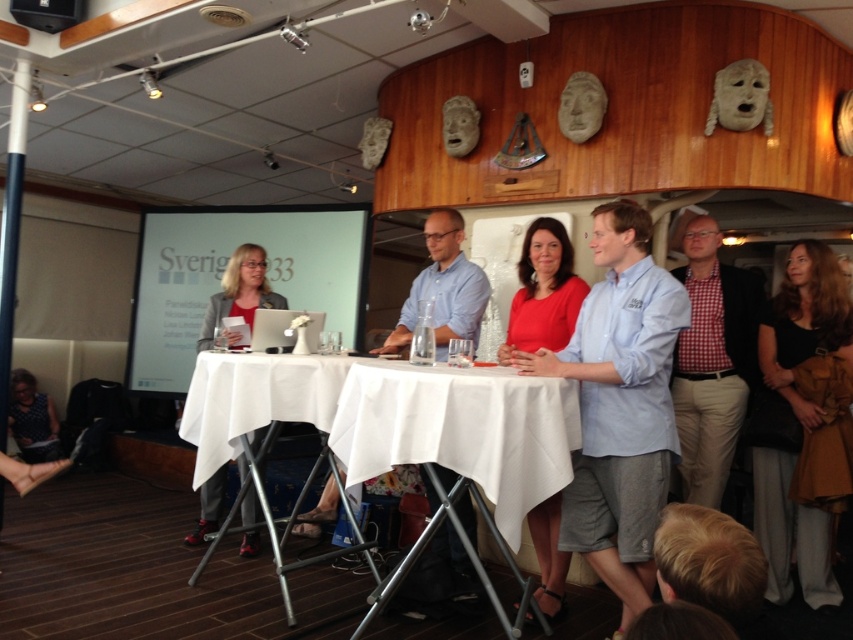
You are attending a formal event and notice two dresses at the center of the room. The black fabric dress at center and the matte red dress at center. Which dress is closer to the front?

The black fabric dress at center is closer to the front because the matte red dress at center is positioned behind it.